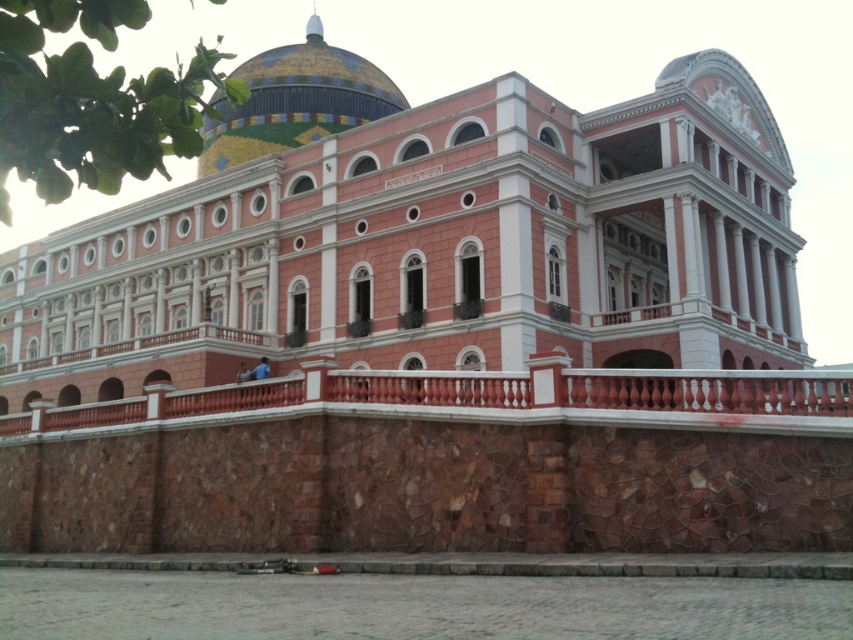
Question: Where is pink stone building at center located in relation to red stone railing at center in the image?

Choices:
 (A) below
 (B) above

Answer: (B)

Question: Does pink stone building at center lie behind mosaic tile dome at upper center?

Choices:
 (A) no
 (B) yes

Answer: (A)

Question: Which object appears farthest from the camera in this image?

Choices:
 (A) pink stone building at center
 (B) red stone railing at center
 (C) mosaic tile dome at upper center

Answer: (B)

Question: Is pink stone building at center thinner than red stone railing at center?

Choices:
 (A) no
 (B) yes

Answer: (A)

Question: Which object is positioned farthest from the pink stone building at center?

Choices:
 (A) mosaic tile dome at upper center
 (B) red stone railing at center

Answer: (B)

Question: Considering the real-world distances, which object is closest to the red stone railing at center?

Choices:
 (A) pink stone building at center
 (B) mosaic tile dome at upper center

Answer: (A)